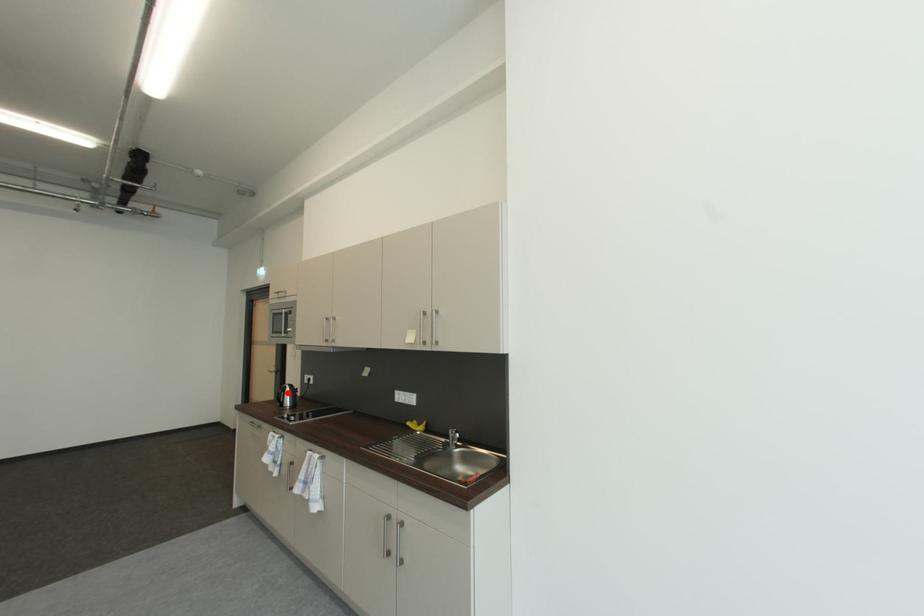
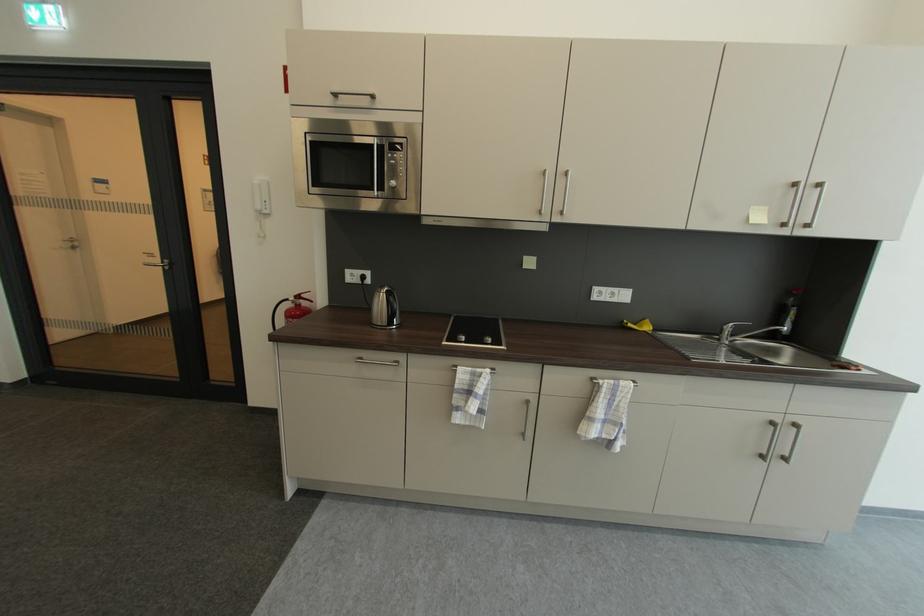
Question: A red point is marked in image1. In image2, is the corresponding 3D point closer to the camera or farther? Reply with the corresponding letter.

Choices:
 (A) The corresponding 3D point is closer.
 (B) The corresponding 3D point is farther.

Answer: (A)